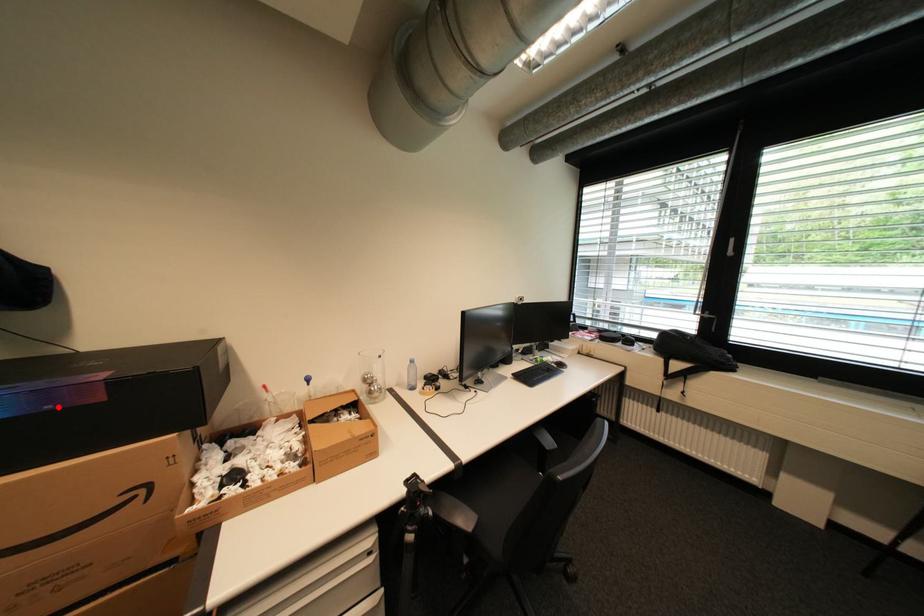
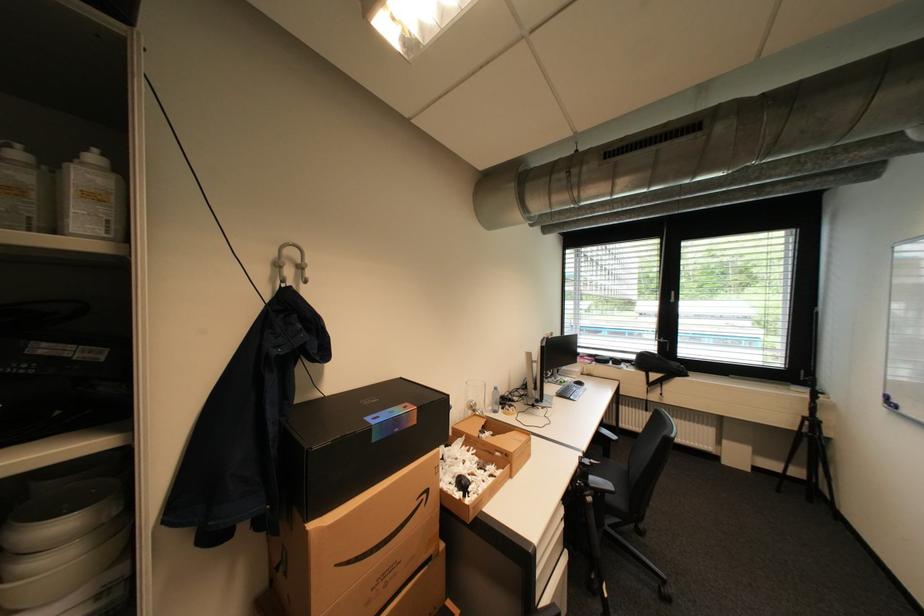
Where in the second image is the point corresponding to the highlighted location from the first image?

(405, 431)